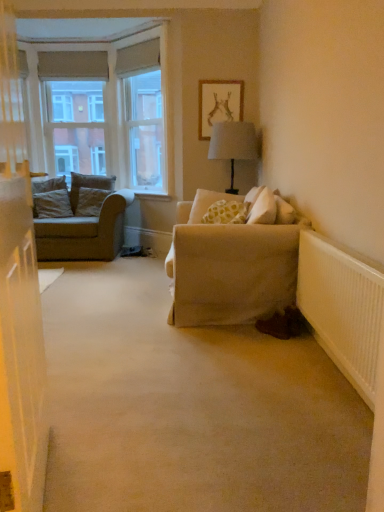
This screenshot has height=512, width=384. What do you see at coordinates (219, 104) in the screenshot? I see `matte wooden picture frame at upper center` at bounding box center [219, 104].

Locate an element on the screen. white painted wood at upper left is located at coordinates (141, 114).

Measure the distance between point (152, 104) and camera.

They are 5.80 meters apart.

At what (x,y) coordinates should I click in order to perform the action: click on textured gray pillow at left, the 3th pillow positioned from the front. Please return your answer as a coordinate pair (x, y). Looking at the image, I should click on (90, 201).

Where is `white painted wood at center`? The width and height of the screenshot is (384, 512). white painted wood at center is located at coordinates (153, 196).

Locate an element on the screen. The image size is (384, 512). yellow dotted fabric pillow at center, positioned as the first pillow in right-to-left order is located at coordinates (208, 203).

Image resolution: width=384 pixels, height=512 pixels. What are the coordinates of `light gray fabric pillow at left, arranged as the third pillow when viewed from the back` in the screenshot? It's located at (53, 204).

The height and width of the screenshot is (512, 384). In order to click on textured gray pillow at left, the fourth pillow positioned from the front in this screenshot , I will do [x=88, y=185].

Does textured gray pillow at left, the 3th pillow when ordered from right to left, come behind white painted wood at center?

Yes, textured gray pillow at left, the 3th pillow when ordered from right to left, is further from the camera.

Is textured gray pillow at left, marked as the first pillow in a back-to-front arrangement, beside white painted wood at center?

textured gray pillow at left, marked as the first pillow in a back-to-front arrangement, and white painted wood at center are not in contact.

Is textured gray pillow at left, marked as the first pillow in a back-to-front arrangement, at the left side of white painted wood at center?

Yes.

The height and width of the screenshot is (512, 384). I want to click on pillow behind the white painted wood at center, so click(88, 185).

From the image's perspective, would you say textured gray pillow at left, which is the 3th pillow from left to right, is shown under white ribbed radiator at lower right?

Incorrect, from the image's perspective, textured gray pillow at left, which is the 3th pillow from left to right, is higher than white ribbed radiator at lower right.

Consider the image. Is textured gray pillow at left, which is counted as the 2th pillow, starting from the back, next to white ribbed radiator at lower right and touching it?

No, textured gray pillow at left, which is counted as the 2th pillow, starting from the back, is not in contact with white ribbed radiator at lower right.

Is textured gray pillow at left, which is counted as the 2th pillow, starting from the back, located outside white ribbed radiator at lower right?

Yes.

What are the coordinates of `radiator lying on the right of textured gray pillow at left, which is counted as the 2th pillow, starting from the back` in the screenshot? It's located at (342, 307).

Is yellow dotted fabric pillow at center, which is the first pillow from front to back, far away from beige fabric couch at left?

Yes, yellow dotted fabric pillow at center, which is the first pillow from front to back, is far from beige fabric couch at left.

Which is nearer, (206, 202) or (118, 195)?

Clearly, point (206, 202) is closer to the camera than point (118, 195).

Can you confirm if yellow dotted fabric pillow at center, positioned as the first pillow in right-to-left order, is shorter than beige fabric couch at left?

Yes.

In the image, is yellow dotted fabric pillow at center, positioned as the first pillow in right-to-left order, positioned in front of or behind beige fabric couch at left?

In the image, yellow dotted fabric pillow at center, positioned as the first pillow in right-to-left order, appears in front of beige fabric couch at left.

Considering the positions of objects textured gray pillow at left, the 3th pillow positioned from the front, and beige fabric couch at left in the image provided, who is more to the right, textured gray pillow at left, the 3th pillow positioned from the front, or beige fabric couch at left?

textured gray pillow at left, the 3th pillow positioned from the front, is more to the right.

Between textured gray pillow at left, the 3th pillow positioned from the front, and beige fabric couch at left, which one is positioned behind?

textured gray pillow at left, the 3th pillow positioned from the front.

Is textured gray pillow at left, the second pillow viewed from the right, located outside beige fabric couch at left?

That's incorrect, textured gray pillow at left, the second pillow viewed from the right, is not completely outside beige fabric couch at left.

From the image's perspective, does textured gray pillow at left, the 3th pillow positioned from the front, appear higher than beige fabric couch at left?

Yes, from the image's perspective, textured gray pillow at left, the 3th pillow positioned from the front, is over beige fabric couch at left.

Is point (315, 267) closer or farther from the camera than point (195, 215)?

Point (315, 267).

Is white ribbed radiator at lower right bigger than yellow dotted fabric pillow at center, which is the first pillow from front to back?

Yes, white ribbed radiator at lower right is bigger than yellow dotted fabric pillow at center, which is the first pillow from front to back.

How different are the orientations of white ribbed radiator at lower right and yellow dotted fabric pillow at center, positioned as the first pillow in right-to-left order, in degrees?

The angle between the facing direction of white ribbed radiator at lower right and the facing direction of yellow dotted fabric pillow at center, positioned as the first pillow in right-to-left order, is 75.3 degrees.

Are white ribbed radiator at lower right and yellow dotted fabric pillow at center, the fourth pillow from the back, beside each other?

No, white ribbed radiator at lower right is not next to yellow dotted fabric pillow at center, the fourth pillow from the back.

Considering the sizes of objects light gray fabric pillow at left, which appears as the 2th pillow when viewed from the front, and yellow dotted fabric pillow at center, the fourth pillow from the back, in the image provided, who is bigger, light gray fabric pillow at left, which appears as the 2th pillow when viewed from the front, or yellow dotted fabric pillow at center, the fourth pillow from the back,?

light gray fabric pillow at left, which appears as the 2th pillow when viewed from the front.

Which is behind, point (66, 210) or point (194, 214)?

The point (66, 210) is farther from the camera.

Can you tell me how much light gray fabric pillow at left, which appears as the 2th pillow when viewed from the front, and yellow dotted fabric pillow at center, the fourth pillow from the back, differ in facing direction?

The angular difference between light gray fabric pillow at left, which appears as the 2th pillow when viewed from the front, and yellow dotted fabric pillow at center, the fourth pillow from the back, is 40.4 degrees.

How distant is light gray fabric pillow at left, which is the 4th pillow in right-to-left order, from yellow dotted fabric pillow at center, the fourth pillow from the left?

1.97 meters.

Considering the relative sizes of white ribbed radiator at lower right and carpet at center in the image provided, is white ribbed radiator at lower right bigger than carpet at center?

Actually, white ribbed radiator at lower right might be smaller than carpet at center.

Looking at this image, from the image's perspective, is white ribbed radiator at lower right under carpet at center?

Actually, white ribbed radiator at lower right appears above carpet at center in the image.

Considering the positions of objects white ribbed radiator at lower right and carpet at center in the image provided, who is more to the right, white ribbed radiator at lower right or carpet at center?

Positioned to the right is white ribbed radiator at lower right.

In the scene shown: Is there a large distance between white ribbed radiator at lower right and carpet at center?

No, white ribbed radiator at lower right is in close proximity to carpet at center.

Where is `pillow that is behind the white painted wood at center`? Image resolution: width=384 pixels, height=512 pixels. pillow that is behind the white painted wood at center is located at coordinates (88, 185).

Which pillow is the 2nd one when counting from the left side of the white ribbed radiator at lower right? Please provide its 2D coordinates.

[(90, 201)]

Estimate the real-world distances between objects in this image. Which object is further from matte wooden picture frame at upper center, light gray fabric pillow at left, which is the 4th pillow in right-to-left order, or carpet at center?

carpet at center lies further to matte wooden picture frame at upper center than the other object.

Based on their spatial positions, is white painted wood at center or white ribbed radiator at lower right closer to light gray fabric pillow at left, which appears as the 2th pillow when viewed from the front?

white painted wood at center.

Looking at the image, which one is located further to white painted wood at center, light gray fabric pillow at left, arranged as the third pillow when viewed from the back, or white ribbed radiator at lower right?

white ribbed radiator at lower right.

Looking at the image, which one is located closer to beige fabric couch at left, white painted wood at center or carpet at center?

Among the two, white painted wood at center is located nearer to beige fabric couch at left.

Which object lies nearer to the anchor point beige fabric couch at left, carpet at center or yellow dotted fabric pillow at center, the fourth pillow from the back?

The object closer to beige fabric couch at left is yellow dotted fabric pillow at center, the fourth pillow from the back.

Considering their positions, is white painted wood at upper left positioned closer to beige fabric couch at left than yellow dotted fabric pillow at center, which is the first pillow from front to back?

yellow dotted fabric pillow at center, which is the first pillow from front to back, lies closer to beige fabric couch at left than the other object.

Looking at the image, which one is located closer to white painted wood at upper left, yellow dotted fabric pillow at center, which is the first pillow from front to back, or matte wooden picture frame at upper center?

matte wooden picture frame at upper center.

Consider the image. Considering their positions, is white painted wood at upper left positioned further to textured gray pillow at left, the 2th pillow in the left-to-right sequence, than white painted wood at center?

Among the two, white painted wood at upper left is located further to textured gray pillow at left, the 2th pillow in the left-to-right sequence.

You are a GUI agent. You are given a task and a screenshot of the screen. Output one action in this format:
    pyautogui.click(x=<x>, y=<y>)
    Task: Click on the window frame between white ribbed radiator at lower right and white painted wood at center in the front-back direction
    The image size is (384, 512).
    Given the screenshot: What is the action you would take?
    pyautogui.click(x=141, y=114)

Identify the location of studio couch between light gray fabric pillow at left, arranged as the third pillow when viewed from the back, and matte wooden picture frame at upper center, in the horizontal direction. (85, 225).

Where is `window frame positioned between white ribbed radiator at lower right and textured gray pillow at left, the 2th pillow in the left-to-right sequence, from near to far`? window frame positioned between white ribbed radiator at lower right and textured gray pillow at left, the 2th pillow in the left-to-right sequence, from near to far is located at coordinates (141, 114).

The image size is (384, 512). Find the location of `window sill between beige fabric couch at left and matte wooden picture frame at upper center from left to right`. window sill between beige fabric couch at left and matte wooden picture frame at upper center from left to right is located at coordinates (153, 196).